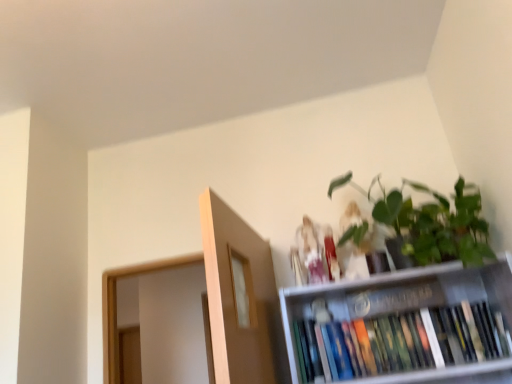
Question: In terms of width, does hardcover books at upper right look wider or thinner when compared to matte white figurine at upper center, which appears as the 2th toy when viewed from the right?

Choices:
 (A) thin
 (B) wide

Answer: (B)

Question: Considering the positions of point (390, 337) and point (306, 228), is point (390, 337) closer or farther from the camera than point (306, 228)?

Choices:
 (A) farther
 (B) closer

Answer: (B)

Question: Estimate the real-world distances between objects in this image. Which object is closer to the hardcover books at upper right?

Choices:
 (A) green matte plant at upper right
 (B) matte white figurine at upper center, which appears as the 2th toy when viewed from the right
 (C) matte white figurine at upper center, which ranks as the 2th toy in left-to-right order

Answer: (C)

Question: Which object is positioned farthest from the matte white figurine at upper center, which ranks as the 2th toy in left-to-right order?

Choices:
 (A) matte white figurine at upper center, which appears as the 2th toy when viewed from the right
 (B) hardcover books at upper right
 (C) green matte plant at upper right

Answer: (B)